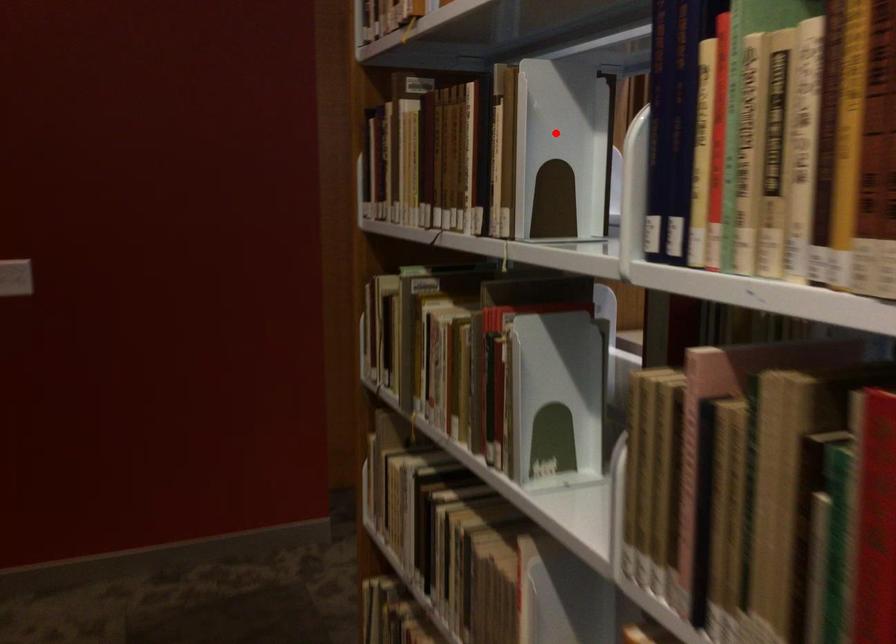
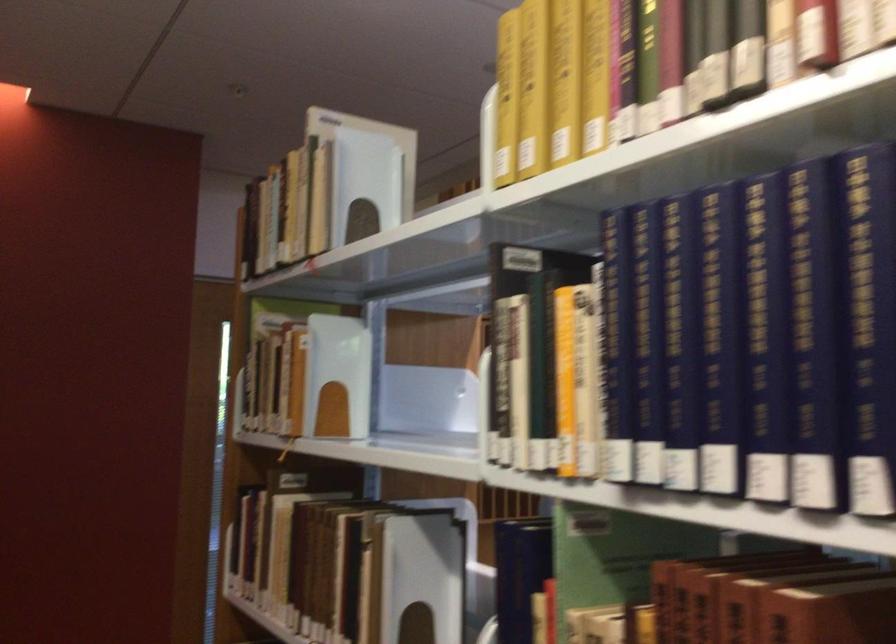
Question: I am providing you with two images of the same scene from different viewpoints. Given a red point in image1, look at the same physical point in image2. Is it:

Choices:
 (A) Closer to the viewpoint
 (B) Farther from the viewpoint

Answer: (B)